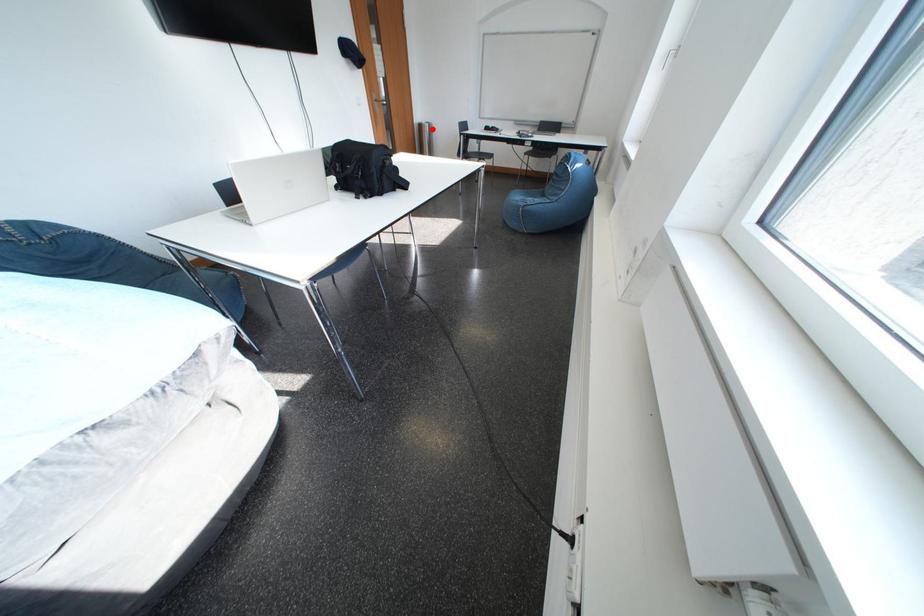
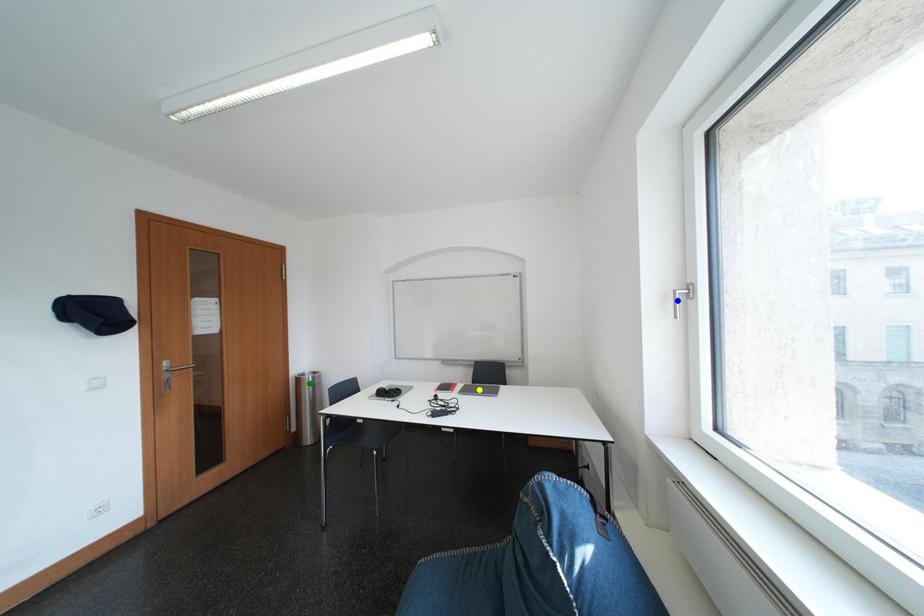
Question: I am providing you with two images of the same scene from different viewpoints. A red point is marked on the first image. You are given multiple points on the second image. Which point in image 2 represents the same 3d spot as the red point in image 1?

Choices:
 (A) yellow point
 (B) blue point
 (C) green point

Answer: (C)